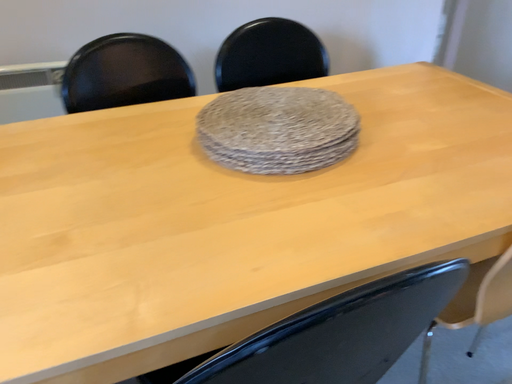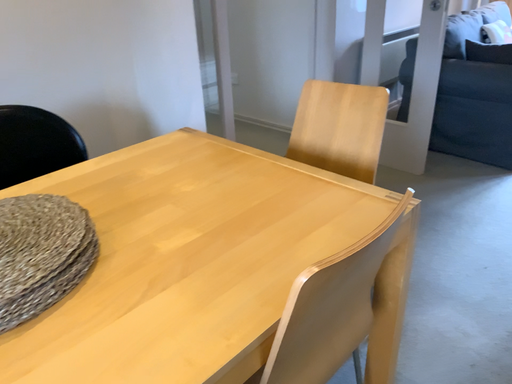
Question: How did the camera likely rotate when shooting the video?

Choices:
 (A) rotated right
 (B) rotated left

Answer: (A)